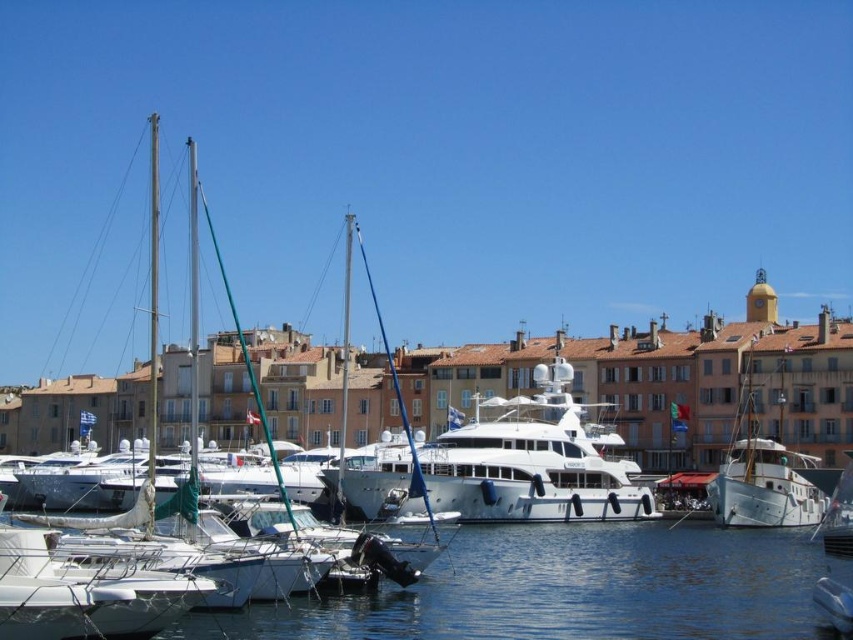
Is the position of white glossy yacht at center more distant than that of white wooden sailboat at right?

No, white glossy yacht at center is closer to the viewer.

Who is positioned more to the right, white glossy yacht at center or white wooden sailboat at right?

white wooden sailboat at right is more to the right.

Between point (367, 512) and point (735, 509), which one is positioned in front?

Point (735, 509) is in front.

Locate an element on the screen. Image resolution: width=853 pixels, height=640 pixels. white glossy yacht at center is located at coordinates click(x=509, y=465).

The image size is (853, 640). Describe the element at coordinates (509, 465) in the screenshot. I see `white glossy yacht at center` at that location.

Does white glossy yacht at center have a greater height compared to white glossy sailboat at left?

Incorrect, white glossy yacht at center's height is not larger of white glossy sailboat at left's.

Where is `white glossy yacht at center`? white glossy yacht at center is located at coordinates (509, 465).

Is clear blue water at lower center above white glossy sailboat at left?

Incorrect, clear blue water at lower center is not positioned above white glossy sailboat at left.

Between point (633, 561) and point (192, 308), which one is positioned behind?

The point (192, 308) is behind.

In order to click on clear blue water at lower center in this screenshot , I will do `click(572, 589)`.